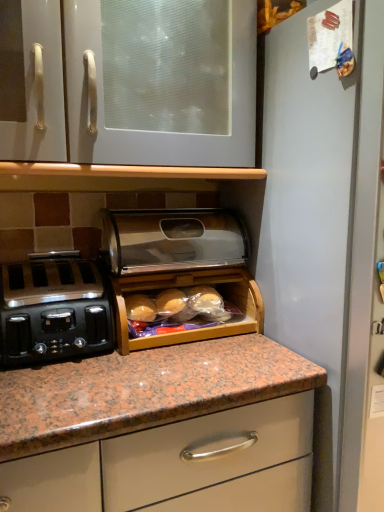
Question: Is point (145, 285) closer or farther from the camera than point (112, 61)?

Choices:
 (A) farther
 (B) closer

Answer: (A)

Question: Is wooden bread box at center, which is the first appliance from bottom to top, situated inside white glossy cabinet at upper center or outside?

Choices:
 (A) outside
 (B) inside

Answer: (A)

Question: Considering the real-world distances, which object is closest to the white glossy cabinet at upper center?

Choices:
 (A) polished stainless steel bread box at center, the 2th appliance ordered from the bottom
 (B) satin black toaster at left
 (C) wooden bread box at center, which is the first appliance from bottom to top

Answer: (A)

Question: Which of these objects is positioned closest to the white glossy cabinet at upper center?

Choices:
 (A) satin black toaster at left
 (B) polished stainless steel bread box at center, which appears as the 1th appliance when viewed from the top
 (C) wooden bread box at center, which is the first appliance from bottom to top

Answer: (B)